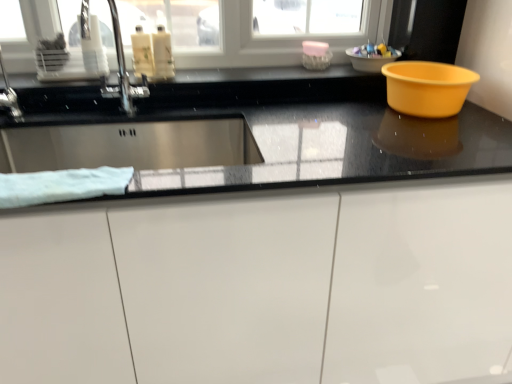
Question: Could you tell me if matte plastic bowl at upper right, the 2th basin when ordered from bottom to top, is turned towards translucent plastic bottles at upper center, which appears as the 1th liquid when viewed from the left?

Choices:
 (A) yes
 (B) no

Answer: (B)

Question: From a real-world perspective, is matte plastic bowl at upper right, the 1th basin when ordered from top to bottom, located beneath translucent plastic bottles at upper center, the 2th liquid when ordered from right to left?

Choices:
 (A) no
 (B) yes

Answer: (B)

Question: Is matte plastic bowl at upper right, the 2th basin when ordered from bottom to top, positioned behind translucent plastic bottles at upper center, which appears as the 1th liquid when viewed from the left?

Choices:
 (A) yes
 (B) no

Answer: (A)

Question: Is matte plastic bowl at upper right, the 2th basin when ordered from bottom to top, completely or partially outside of translucent plastic bottles at upper center, the 2th liquid when ordered from right to left?

Choices:
 (A) yes
 (B) no

Answer: (A)

Question: Is matte plastic bowl at upper right, the 2th basin when ordered from bottom to top, positioned with its back to translucent plastic bottles at upper center, the 2th liquid when ordered from right to left?

Choices:
 (A) no
 (B) yes

Answer: (A)

Question: Is the surface of matte plastic bowl at upper right, the 1th basin when ordered from top to bottom, in direct contact with translucent plastic bottles at upper center, which appears as the 1th liquid when viewed from the left?

Choices:
 (A) no
 (B) yes

Answer: (A)

Question: From the image's perspective, is translucent plastic bottles at upper center, which ranks as the 2th liquid in left-to-right order, located above plastic bowl at upper right?

Choices:
 (A) yes
 (B) no

Answer: (B)

Question: Is translucent plastic bottles at upper center, which ranks as the 2th liquid in left-to-right order, turned away from plastic bowl at upper right?

Choices:
 (A) no
 (B) yes

Answer: (A)

Question: Can you see translucent plastic bottles at upper center, which is the 1th liquid in right-to-left order, touching plastic bowl at upper right?

Choices:
 (A) no
 (B) yes

Answer: (A)

Question: From the image's perspective, does translucent plastic bottles at upper center, which ranks as the 2th liquid in left-to-right order, appear lower than plastic bowl at upper right?

Choices:
 (A) no
 (B) yes

Answer: (B)

Question: Considering the relative positions of translucent plastic bottles at upper center, which is the 1th liquid in right-to-left order, and plastic bowl at upper right in the image provided, is translucent plastic bottles at upper center, which is the 1th liquid in right-to-left order, to the left of plastic bowl at upper right from the viewer's perspective?

Choices:
 (A) no
 (B) yes

Answer: (B)

Question: Considering the relative sizes of translucent plastic bottles at upper center, which is the 1th liquid in right-to-left order, and plastic bowl at upper right in the image provided, is translucent plastic bottles at upper center, which is the 1th liquid in right-to-left order, shorter than plastic bowl at upper right?

Choices:
 (A) yes
 (B) no

Answer: (B)

Question: Considering the relative positions of white soft towel at left and translucent plastic bottles at upper center, the 2th liquid when ordered from right to left, in the image provided, is white soft towel at left behind translucent plastic bottles at upper center, the 2th liquid when ordered from right to left,?

Choices:
 (A) yes
 (B) no

Answer: (B)